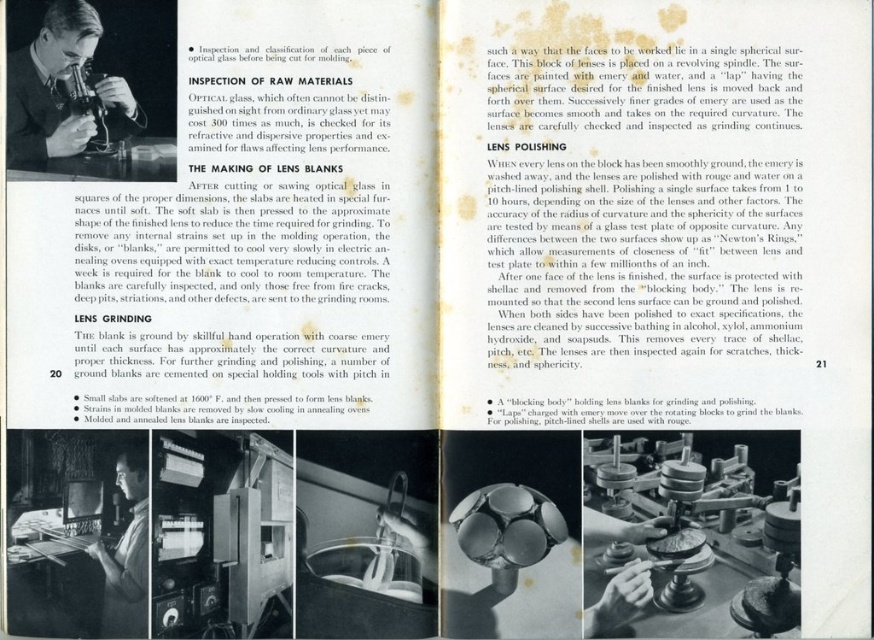
You are a quality inspector in a lens manufacturing facility. You need to examine the raw optical glass under a microscope. Where should you look on the two page spread to find the light brown wood microscope at upper left?

A: The light brown wood microscope at upper left is located at point [50,88] on the two page spread.

Based on the photo, you are an engineer reviewing the manual and notice the light brown wood microscope at upper left and the smooth skin face at lower left. Which object is positioned closer to the bottom of the page?

The smooth skin face at lower left is positioned closer to the bottom of the page than the light brown wood microscope at upper left.

You are a quality inspector in a lens manufacturing facility. You need to locate the point at coordinates [50,88] on the microscope. Where exactly is this point located on the light brown wood microscope at upper left?

The point at coordinates [50,88] is located on the light brown wood microscope at upper left.